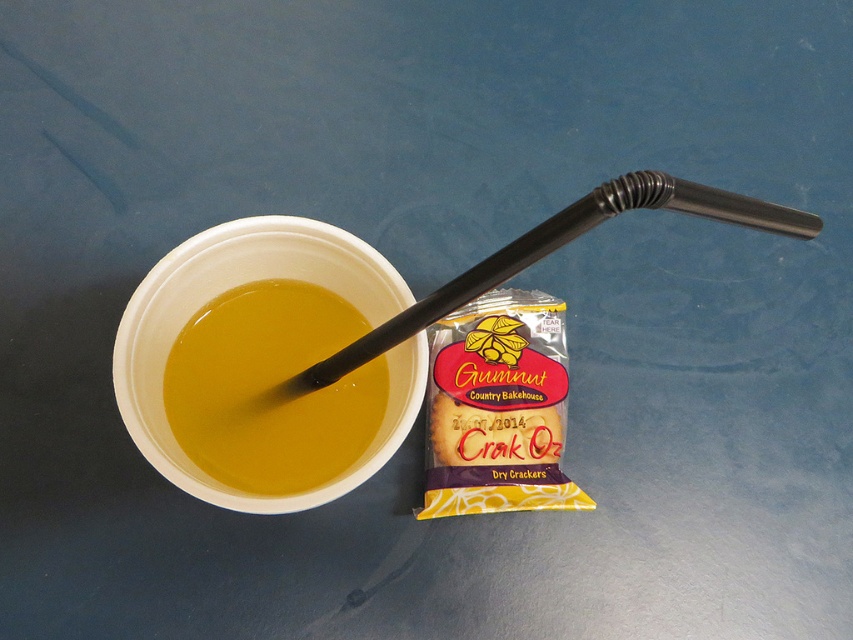
Does yellow matte liquid at center appear over black plastic straw at upper center?

No, yellow matte liquid at center is not above black plastic straw at upper center.

The height and width of the screenshot is (640, 853). What do you see at coordinates (270, 388) in the screenshot? I see `yellow matte liquid at center` at bounding box center [270, 388].

Between point (358, 410) and point (358, 360), which one is positioned behind?

Positioned behind is point (358, 410).

Where is `yellow matte liquid at center`? Image resolution: width=853 pixels, height=640 pixels. yellow matte liquid at center is located at coordinates click(x=270, y=388).